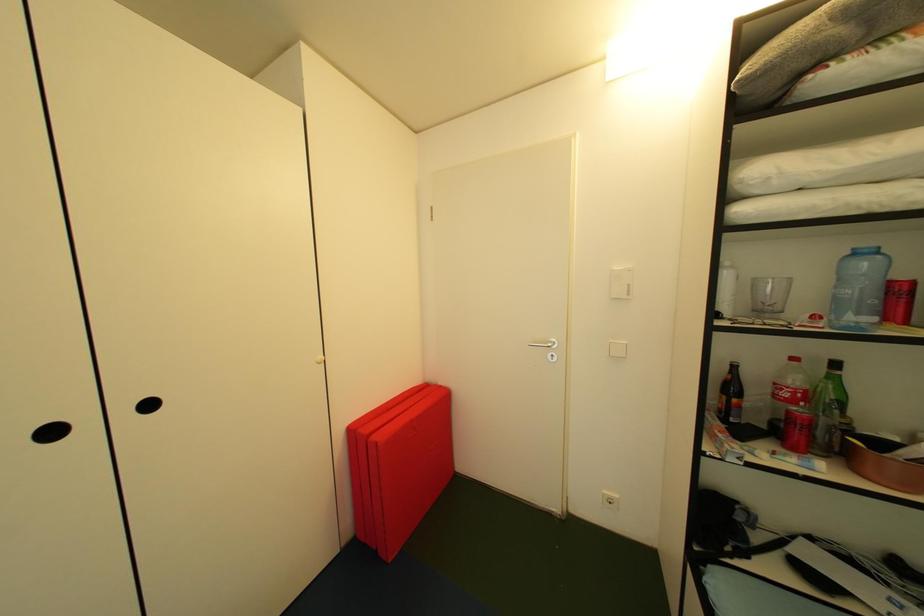
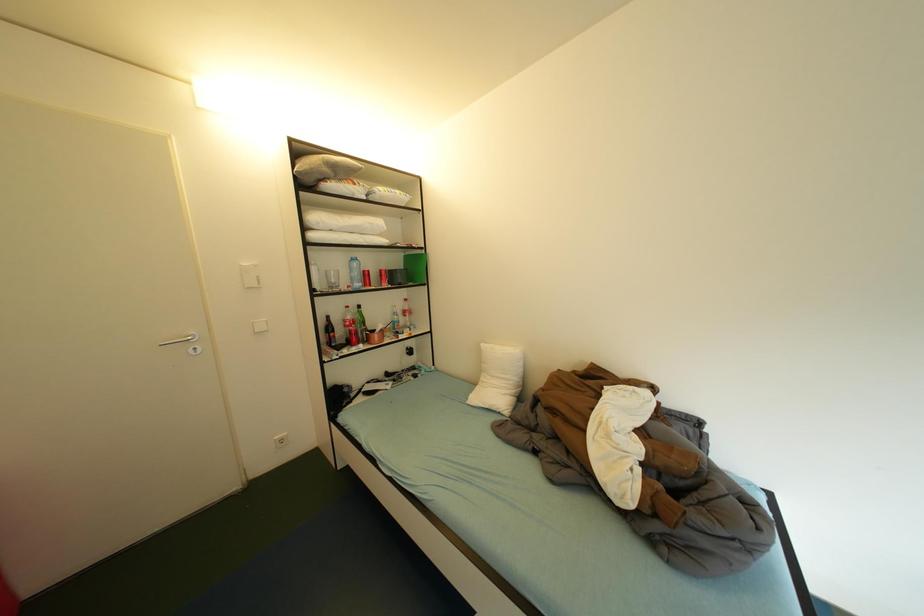
Question: Based on the continuous images, in which direction is the camera rotating? Reply with the corresponding letter.

Choices:
 (A) Left
 (B) Right
 (C) Up
 (D) Down

Answer: (B)